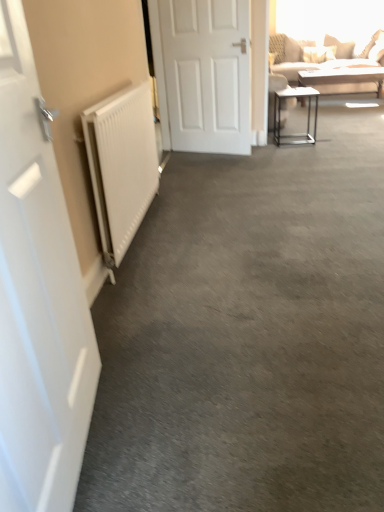
Describe the element at coordinates (307, 115) in the screenshot. The height and width of the screenshot is (512, 384). I see `metallic silver table at right, the 1th table viewed from the front` at that location.

What do you see at coordinates (203, 74) in the screenshot?
I see `white matte door at center, the first door in the top-to-bottom sequence` at bounding box center [203, 74].

Measure the distance between white glossy table at upper right, the first table viewed from the top, and camera.

The distance of white glossy table at upper right, the first table viewed from the top, from camera is 4.59 meters.

The width and height of the screenshot is (384, 512). Describe the element at coordinates (290, 56) in the screenshot. I see `beige fabric couch at upper right` at that location.

At what (x,y) coordinates should I click in order to perform the action: click on metallic silver table at right, positioned as the 2th table in back-to-front order. Please return your answer as a coordinate pair (x, y). The width and height of the screenshot is (384, 512). Looking at the image, I should click on (307, 115).

Between white matte radiator at left and white matte door at center, which is the second door from front to back, which one has more height?

Standing taller between the two is white matte door at center, which is the second door from front to back.

From the image's perspective, is white matte radiator at left located above or below white matte door at center, which is the second door from front to back?

Based on their image positions, white matte radiator at left is located beneath white matte door at center, which is the second door from front to back.

Between white matte radiator at left and white matte door at center, the 2th door when ordered from bottom to top, which one has larger size?

white matte door at center, the 2th door when ordered from bottom to top.

Could you tell me if white matte radiator at left is facing white matte door at center, the first door in the top-to-bottom sequence?

No, white matte radiator at left is not oriented towards white matte door at center, the first door in the top-to-bottom sequence.

Does white matte door at center, the first door in the top-to-bottom sequence, have a lesser height compared to white matte radiator at left?

No.

Considering the relative positions of white matte door at center, which is the 2th door in left-to-right order, and white matte radiator at left in the image provided, is white matte door at center, which is the 2th door in left-to-right order, to the left or to the right of white matte radiator at left?

white matte door at center, which is the 2th door in left-to-right order, is to the right of white matte radiator at left.

How many degrees apart are the facing directions of white matte door at center, acting as the first door starting from the right, and white matte radiator at left?

white matte door at center, acting as the first door starting from the right, and white matte radiator at left are facing 111 degrees away from each other.

Could you tell me if white matte door at center, the 2th door when ordered from bottom to top, is turned towards white matte radiator at left?

Yes, white matte door at center, the 2th door when ordered from bottom to top, is oriented towards white matte radiator at left.

How much distance is there between metallic silver table at right, the 1th table viewed from the front, and white matte radiator at left?

metallic silver table at right, the 1th table viewed from the front, is 7.09 feet away from white matte radiator at left.

Would you consider metallic silver table at right, positioned as the 2th table in back-to-front order, to be distant from white matte radiator at left?

metallic silver table at right, positioned as the 2th table in back-to-front order, is positioned a significant distance from white matte radiator at left.

Is point (280, 140) closer to viewer compared to point (108, 240)?

No, (280, 140) is further to viewer.

Would you say metallic silver table at right, which ranks as the first table in left-to-right order, contains white matte radiator at left?

No, white matte radiator at left is not inside metallic silver table at right, which ranks as the first table in left-to-right order.

Is point (324, 91) more distant than point (105, 215)?

Yes, it is.

Considering the relative sizes of white glossy table at upper right, which ranks as the 2th table in left-to-right order, and white matte radiator at left in the image provided, is white glossy table at upper right, which ranks as the 2th table in left-to-right order, shorter than white matte radiator at left?

Yes, white glossy table at upper right, which ranks as the 2th table in left-to-right order, is shorter than white matte radiator at left.

Which is more to the right, white glossy table at upper right, the first table in the back-to-front sequence, or white matte radiator at left?

From the viewer's perspective, white glossy table at upper right, the first table in the back-to-front sequence, appears more on the right side.

From a real-world perspective, which is physically above, white glossy table at upper right, marked as the second table in a front-to-back arrangement, or white matte radiator at left?

From a 3D spatial view, white matte radiator at left is above.

Is white matte door at left, the second door when ordered from right to left, located outside white matte door at center, acting as the first door starting from the right?

Yes, white matte door at left, the second door when ordered from right to left, is located beyond the bounds of white matte door at center, acting as the first door starting from the right.

Considering the points (81, 359) and (180, 109), which point is in front, point (81, 359) or point (180, 109)?

The point (81, 359) is more forward.

From a real-world perspective, between white matte door at left, the 2th door in the back-to-front sequence, and white matte door at center, acting as the first door starting from the right, who is vertically lower?

white matte door at left, the 2th door in the back-to-front sequence.

From a real-world perspective, between white matte door at center, which is the 2th door in left-to-right order, and beige fabric couch at upper right, who is vertically lower?

From a 3D spatial view, beige fabric couch at upper right is below.

Can you confirm if white matte door at center, the first door in the top-to-bottom sequence, is positioned to the right of beige fabric couch at upper right?

No, white matte door at center, the first door in the top-to-bottom sequence, is not to the right of beige fabric couch at upper right.

Between point (247, 117) and point (340, 55), which one is positioned behind?

Positioned behind is point (340, 55).

What's the angular difference between white matte door at center, acting as the first door starting from the right, and beige fabric couch at upper right's facing directions?

white matte door at center, acting as the first door starting from the right, and beige fabric couch at upper right are facing 20.1 degrees away from each other.

Which of these two, white matte door at center, which is the 2th door in left-to-right order, or white glossy table at upper right, placed as the first table when sorted from right to left, is bigger?

Bigger between the two is white glossy table at upper right, placed as the first table when sorted from right to left.

In the scene shown: Does white matte door at center, the 2th door when ordered from bottom to top, have a greater height compared to white glossy table at upper right, which is the second table from bottom to top?

Yes.

From a real-world perspective, which object rests below the other?

white glossy table at upper right, placed as the first table when sorted from right to left, is physically lower.

Is white glossy table at upper right, the first table viewed from the top, surrounded by white matte door at center, the first door in the top-to-bottom sequence?

That's incorrect, white glossy table at upper right, the first table viewed from the top, is not inside white matte door at center, the first door in the top-to-bottom sequence.

Identify the location of radiator below the white matte door at center, which is the 2th door in left-to-right order (from a real-world perspective). (121, 165).

The width and height of the screenshot is (384, 512). I want to click on door that is the 2nd object above the white matte radiator at left (from a real-world perspective), so coord(203,74).

Which object lies nearer to the anchor point white matte door at left, which appears as the 2th door when viewed from the top, white matte radiator at left or beige fabric couch at upper right?

white matte radiator at left.

Which object lies further to the anchor point white matte radiator at left, white matte door at center, which is the first door in back-to-front order, or white glossy table at upper right, the first table viewed from the top?

white glossy table at upper right, the first table viewed from the top.

Based on their spatial positions, is white matte door at left, the second door when ordered from right to left, or beige fabric couch at upper right closer to white matte radiator at left?

white matte door at left, the second door when ordered from right to left, is positioned closer to the anchor white matte radiator at left.

Considering their positions, is beige fabric couch at upper right positioned further to white matte door at center, which is the second door from front to back, than white glossy table at upper right, marked as the second table in a front-to-back arrangement?

white glossy table at upper right, marked as the second table in a front-to-back arrangement, is further to white matte door at center, which is the second door from front to back.

Looking at this image, when comparing their distances from beige fabric couch at upper right, does white matte door at left, acting as the first door starting from the front, or white glossy table at upper right, placed as the first table when sorted from right to left, seem further?

white matte door at left, acting as the first door starting from the front.

Which object lies further to the anchor point white matte door at center, which is the 2th door in left-to-right order, beige fabric couch at upper right or metallic silver table at right, which ranks as the 2th table in right-to-left order?

beige fabric couch at upper right is further to white matte door at center, which is the 2th door in left-to-right order.

Based on the photo, which object lies further to the anchor point white matte radiator at left, white glossy table at upper right, marked as the second table in a front-to-back arrangement, or white matte door at center, which is the 2th door in left-to-right order?

→ white glossy table at upper right, marked as the second table in a front-to-back arrangement, lies further to white matte radiator at left than the other object.

Which object lies further to the anchor point white glossy table at upper right, the first table viewed from the top, white matte radiator at left or metallic silver table at right, which ranks as the first table in left-to-right order?

white matte radiator at left lies further to white glossy table at upper right, the first table viewed from the top, than the other object.

At what (x,y) coordinates should I click in order to perform the action: click on table located between white matte door at center, which is the second door from front to back, and beige fabric couch at upper right in the left-right direction. Please return your answer as a coordinate pair (x, y). This screenshot has width=384, height=512. Looking at the image, I should click on (307, 115).

I want to click on table between white matte radiator at left and beige fabric couch at upper right along the z-axis, so click(x=307, y=115).

Where is `studio couch between metallic silver table at right, which ranks as the first table in left-to-right order, and white glossy table at upper right, placed as the first table when sorted from right to left, from front to back`? This screenshot has height=512, width=384. studio couch between metallic silver table at right, which ranks as the first table in left-to-right order, and white glossy table at upper right, placed as the first table when sorted from right to left, from front to back is located at coordinates (290, 56).

Locate an element on the screen. This screenshot has width=384, height=512. table between white matte door at left, acting as the first door starting from the front, and beige fabric couch at upper right, along the z-axis is located at coordinates (307, 115).